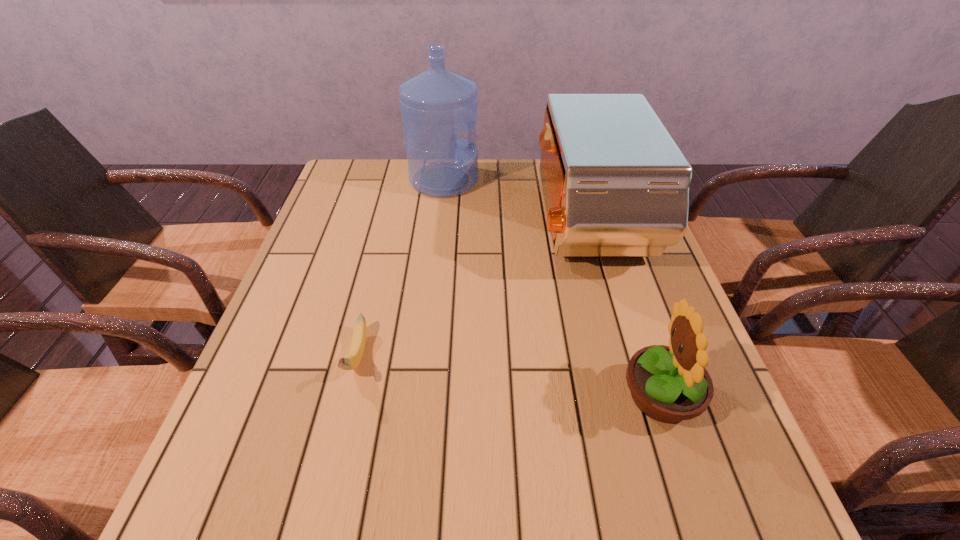
The image size is (960, 540). Find the location of `the second object from left to right`. the second object from left to right is located at coordinates (437, 104).

The image size is (960, 540). Identify the location of the tallest object. (437, 104).

Locate an element on the screen. toaster oven is located at coordinates (615, 183).

Where is `sunflower`? sunflower is located at coordinates (669, 384).

This screenshot has width=960, height=540. I want to click on the shortest object, so click(x=351, y=361).

This screenshot has height=540, width=960. In order to click on banana in this screenshot , I will do `click(351, 361)`.

Image resolution: width=960 pixels, height=540 pixels. Find the location of `vacant space located on the side of the tallest object with the handle`. vacant space located on the side of the tallest object with the handle is located at coordinates (548, 180).

I want to click on vacant space located on the door side of the second tallest object, so click(x=394, y=224).

At what (x,y) coordinates should I click in order to perform the action: click on blank space located 0.370m on the door side of the second tallest object. Please return your answer as a coordinate pair (x, y). The height and width of the screenshot is (540, 960). Looking at the image, I should click on (400, 224).

Find the location of a particular element. vacant space located on the door side of the second tallest object is located at coordinates (390, 224).